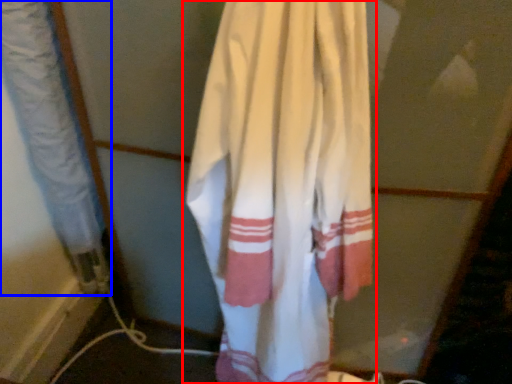
Question: Which point is closer to the camera, curtain (highlighted by a red box) or curtain (highlighted by a blue box)?

Choices:
 (A) curtain
 (B) curtain

Answer: (A)